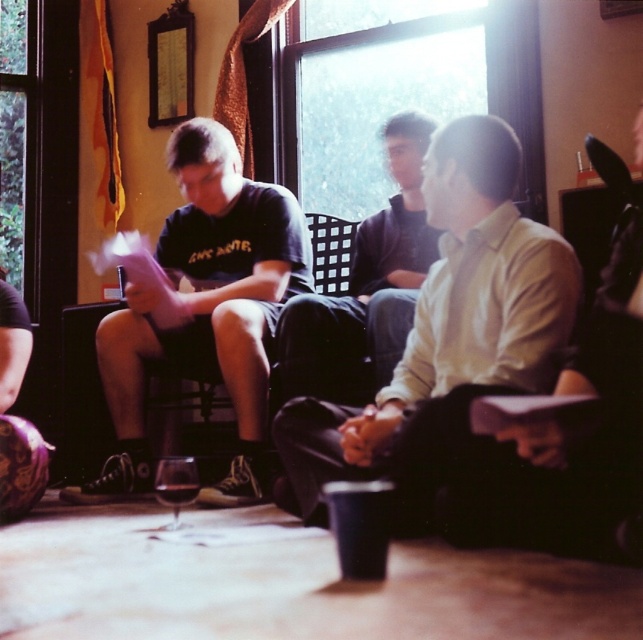
You are planning to buy a new shirt that matches the style of the light beige shirt at center and dark gray shirt at center. If you want a shirt that is bigger in size, which one should you choose?

The light beige shirt at center has a larger size compared to dark gray shirt at center, so you should choose the light beige shirt at center.

You are standing in the living room and want to move from point A to point B. Point A is at coordinate point (222,236) and point B is at coordinate point (158,486). Which direction should you move to get closer to point B?

To move from point A at coordinate point (222,236) to point B at coordinate point (158,486), you should move towards the lower right direction since point B is located at a lower y and higher x coordinate compared to point A.

Consider the image. You are standing in the living room and see two people wearing light beige shirt at center and dark gray shirt at center. Which one is nearer to you?

The light beige shirt at center is closer to the viewer than dark gray shirt at center, so the person wearing the light beige shirt at center is nearer to you.